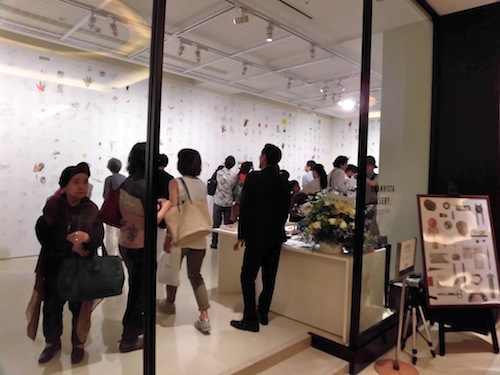
Image resolution: width=500 pixels, height=375 pixels. What are the coordinates of `track lighting` in the screenshot? It's located at (269, 37), (243, 25), (313, 49), (298, 38).